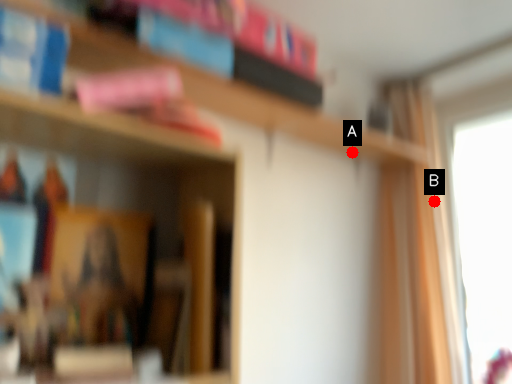
Question: Two points are circled on the image, labeled by A and B beside each circle. Which of the following is the farthest from the observer?

Choices:
 (A) A is further
 (B) B is further

Answer: (B)